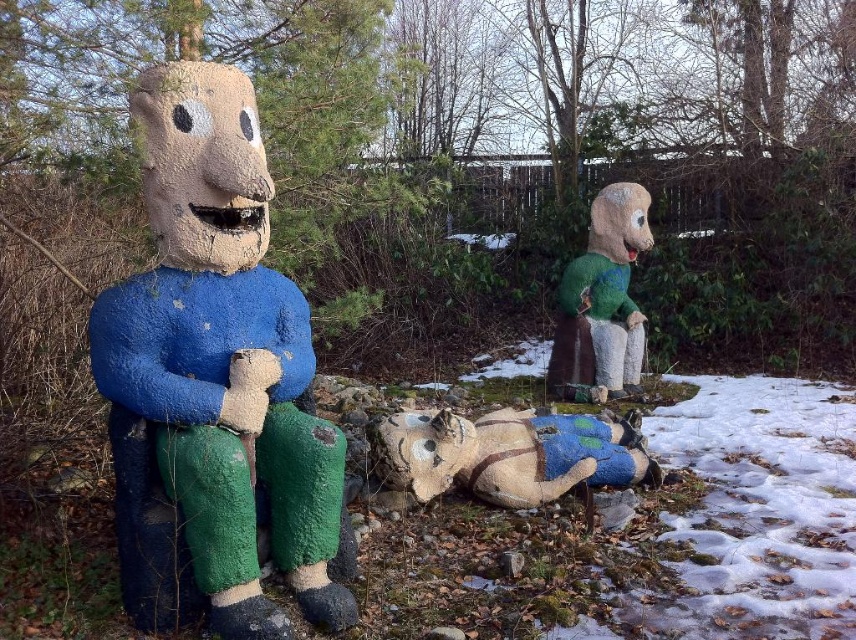
Question: Is blue painted wood figure at left to the right of green felt doll at right from the viewer's perspective?

Choices:
 (A) yes
 (B) no

Answer: (B)

Question: Can you confirm if blue painted wood figure at left is thinner than green felt doll at right?

Choices:
 (A) yes
 (B) no

Answer: (B)

Question: Among these objects, which one is farthest from the camera?

Choices:
 (A) blue painted wood figure at left
 (B) blue painted wood horse at center
 (C) green felt doll at right

Answer: (C)

Question: Which of the following is the closest to the observer?

Choices:
 (A) (302, 356)
 (B) (420, 460)

Answer: (A)

Question: Which point is closer to the camera?

Choices:
 (A) blue painted wood horse at center
 (B) blue painted wood figure at left
 (C) green felt doll at right

Answer: (B)

Question: Is blue painted wood horse at center closer to the viewer compared to green felt doll at right?

Choices:
 (A) yes
 (B) no

Answer: (A)